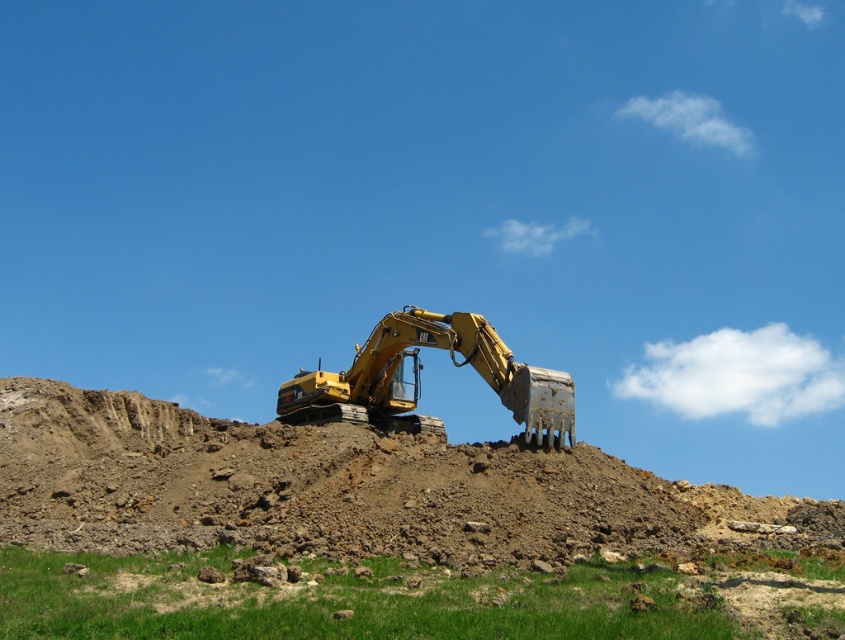
You are a worker standing on the green grass at lower center. You need to reach the matte yellow excavator at center to start your shift. Can you walk directly to it without climbing over anything?

The green grass at lower center is not as tall as the matte yellow excavator at center, so yes, you can walk directly to the matte yellow excavator at center without climbing over the grass since it is shorter than the excavator.

You are a construction worker planning to place a 2m wide equipment container between the green grass at lower center and the matte yellow excavator at center. Can the container fit in the space between them?

The green grass at lower center is wider than the matte yellow excavator at center. However, the description does not provide specific measurements of their widths or the space between them. Therefore, it is impossible to determine if the 2m wide container can fit without additional information.

Looking at this image, you are an engineer assessing the construction site. The matte yellow excavator at center needs to move to a safer area. Considering the brown dirt hill at center, which object is taller and could potentially block the excavator from moving upwards? Please advise based on the height comparison.

The matte yellow excavator at center is taller than the brown dirt hill at center. Therefore, the excavator can move over the hill without obstruction since it is taller than the hill.